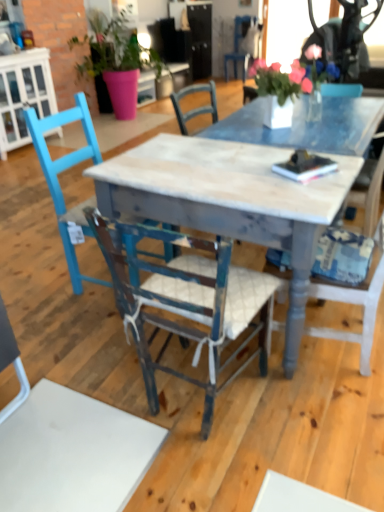
Question: Considering the positions of point (233, 51) and point (122, 114), is point (233, 51) closer or farther from the camera than point (122, 114)?

Choices:
 (A) farther
 (B) closer

Answer: (A)

Question: Considering the relative positions of wooden chair at center, which is counted as the first chair, starting from the top, and matte pink pot at upper left in the image provided, is wooden chair at center, which is counted as the first chair, starting from the top, to the left or to the right of matte pink pot at upper left?

Choices:
 (A) right
 (B) left

Answer: (A)

Question: Which is nearer to the matte pink pot at upper left?

Choices:
 (A) worn wood chair at center, acting as the first chair starting from the front
 (B) wooden chair at center, which is counted as the first chair, starting from the top
 (C) white fabric chair at center, the 2th chair positioned from the front
 (D) blue painted wood chair at left, which appears as the third chair when ordered from the bottom
 (E) white glossy cabinet at left

Answer: (E)

Question: Considering the real-world distances, which object is farthest from the blue painted wood chair at left, the third chair when ordered from front to back?

Choices:
 (A) white glossy cabinet at left
 (B) white fabric chair at center, the 2th chair positioned from the front
 (C) matte pink pot at upper left
 (D) worn wood chair at center, arranged as the 4th chair when viewed from the back
 (E) wooden chair at center, the first chair when ordered from back to front

Answer: (E)